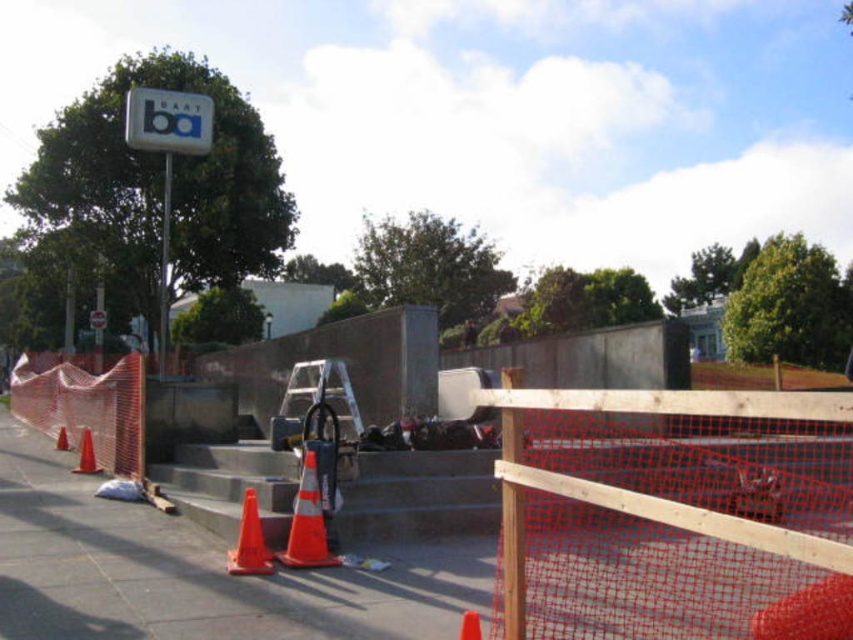
Question: Where is white plastic sign at upper center located in relation to orange matte traffic cone at lower left in the image?

Choices:
 (A) below
 (B) above

Answer: (B)

Question: Which of these objects is positioned closest to the orange reflective cone at lower center?

Choices:
 (A) orange plastic traffic cone at lower left
 (B) orange mesh fence at left
 (C) orange matte traffic cone at lower left

Answer: (C)

Question: Which object is closer to the camera taking this photo?

Choices:
 (A) white plastic sign at upper center
 (B) orange reflective cone at lower center
 (C) wooden mesh fence at center
 (D) orange matte traffic cone at lower left

Answer: (C)

Question: Is white plastic sign at upper left positioned at the back of orange plastic traffic cone at lower left?

Choices:
 (A) yes
 (B) no

Answer: (B)

Question: Which of these objects is positioned farthest from the wooden mesh fence at center?

Choices:
 (A) orange matte traffic cone at center
 (B) orange reflective cone at lower center
 (C) orange plastic traffic cone at lower left
 (D) white plastic sign at upper center

Answer: (C)

Question: Can you confirm if orange mesh fence at left is positioned above orange plastic traffic cone at lower left?

Choices:
 (A) no
 (B) yes

Answer: (B)